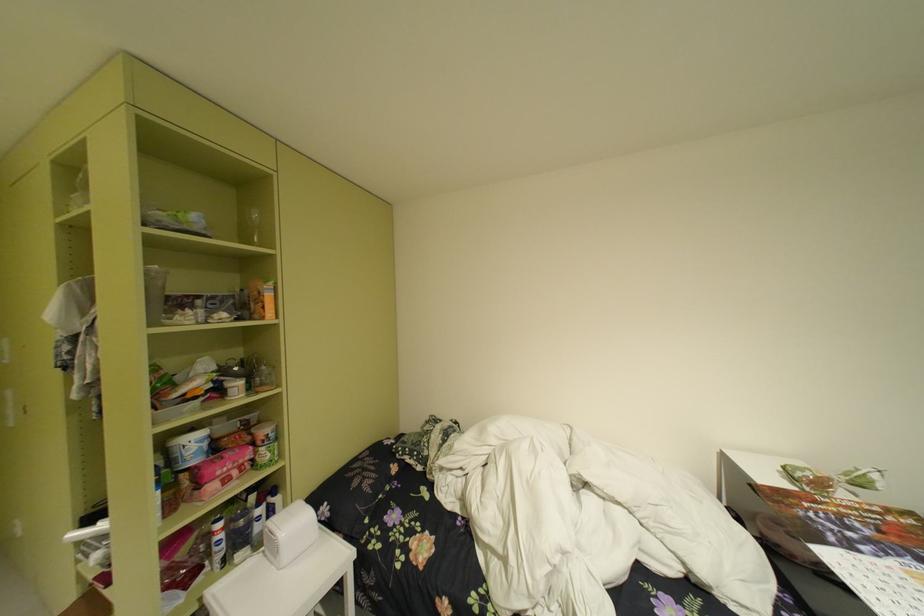
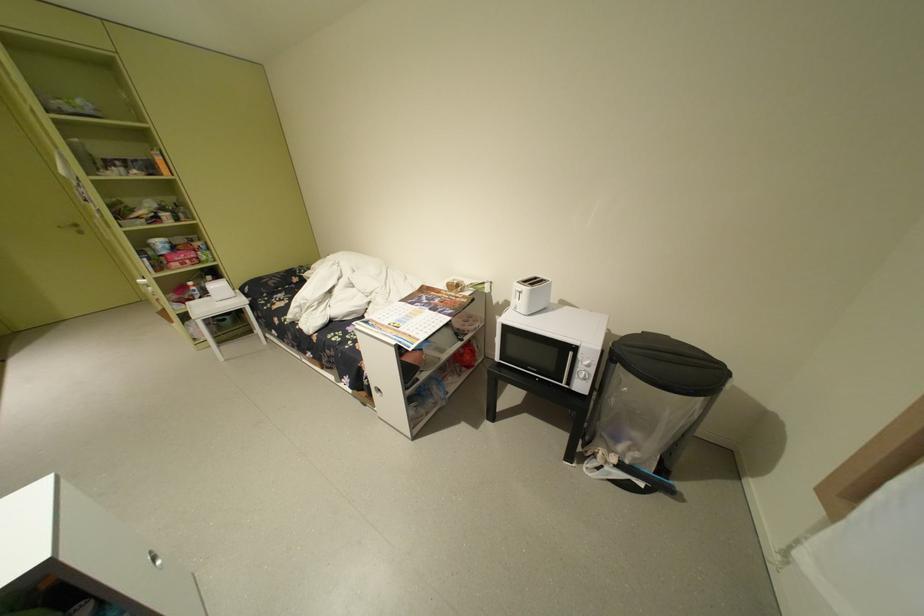
In the second image, find the point that corresponds to [235,528] in the first image.

(204, 286)